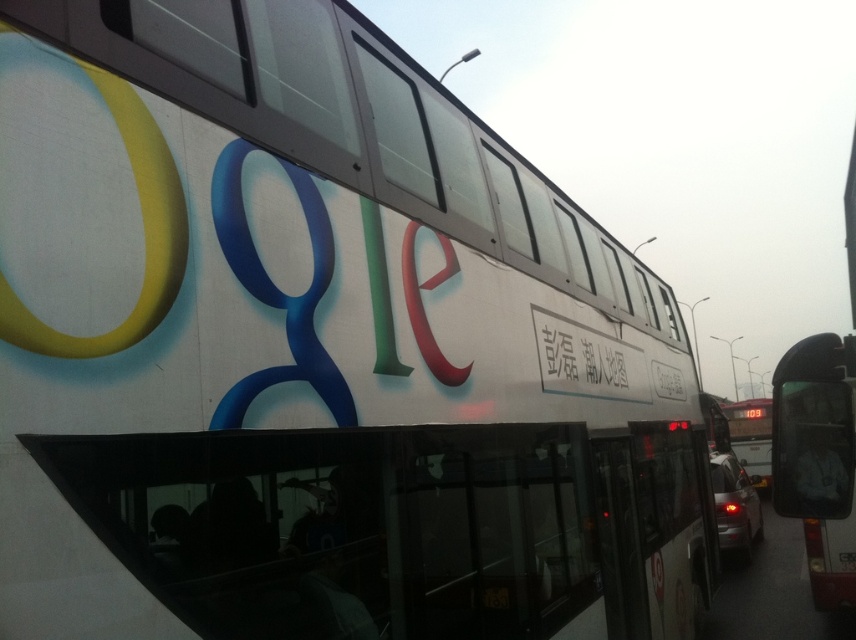
Is point (545, 352) farther from viewer compared to point (749, 474)?

That is False.

Who is more forward, (591,376) or (742,432)?

Point (591,376) is in front.

Is point (586, 387) more distant than point (770, 436)?

No, (586, 387) is in front of (770, 436).

You are a GUI agent. You are given a task and a screenshot of the screen. Output one action in this format:
    pyautogui.click(x=<x>, y=<y>)
    Task: Click on the black matte sign at center
    This screenshot has height=640, width=856.
    Given the screenshot: What is the action you would take?
    pyautogui.click(x=586, y=358)

Which is behind, point (825, 481) or point (752, 424)?

The point (752, 424) is more distant.

In order to click on white glossy bus at right in this screenshot , I will do `click(818, 460)`.

Find the location of `white glossy bus at right`. white glossy bus at right is located at coordinates click(x=818, y=460).

Where is `white glossy bus at right`? white glossy bus at right is located at coordinates (818, 460).

Does white glossy bus at right have a greater height compared to black matte sign at center?

Indeed, white glossy bus at right has a greater height compared to black matte sign at center.

Who is taller, white glossy bus at right or black matte sign at center?

Standing taller between the two is white glossy bus at right.

Locate an element on the screen. This screenshot has height=640, width=856. white glossy bus at right is located at coordinates (818, 460).